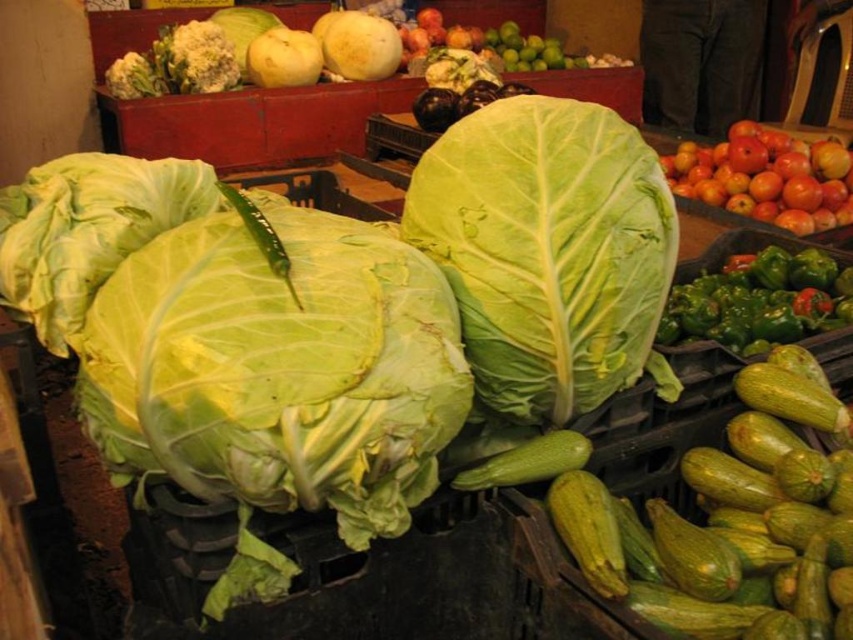
Question: Which object is the farthest from the shiny red apples at upper right?

Choices:
 (A) green leafy at center
 (B) green matte cabbage at left
 (C) green leafy cabbage at center
 (D) green matte pepper at right

Answer: (B)

Question: Which object is closer to the camera taking this photo?

Choices:
 (A) green matte cabbage at left
 (B) green leafy at center

Answer: (A)

Question: Among these objects, which one is nearest to the camera?

Choices:
 (A) green leafy cabbage at center
 (B) green matte pepper at right
 (C) green matte cabbage at left

Answer: (A)

Question: Is green leafy cabbage at center to the left of green leafy at center from the viewer's perspective?

Choices:
 (A) no
 (B) yes

Answer: (B)

Question: Does green matte pepper at right appear under shiny red apples at upper right?

Choices:
 (A) yes
 (B) no

Answer: (A)

Question: Does green matte cabbage at left appear under shiny red apples at upper right?

Choices:
 (A) no
 (B) yes

Answer: (B)